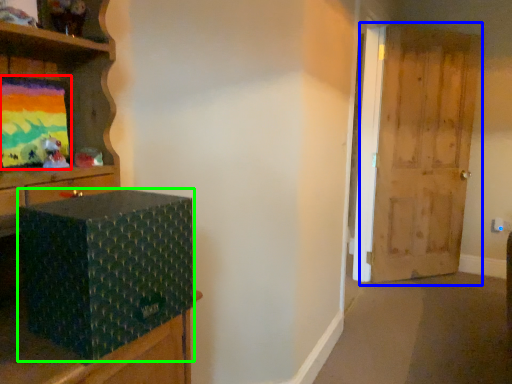
Question: Which object is positioned closest to picture frame (highlighted by a red box)? Select from door (highlighted by a blue box) and box (highlighted by a green box).

Choices:
 (A) door
 (B) box

Answer: (B)